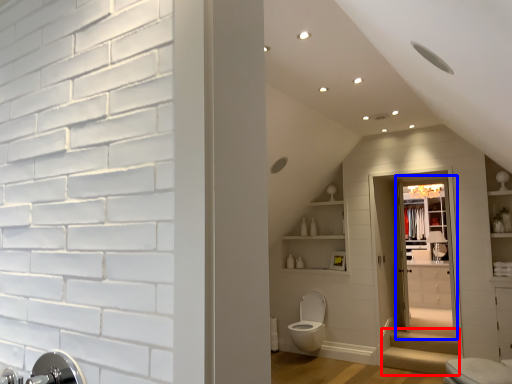
Question: Which of the following is the farthest to the observer, stairwell (highlighted by a red box) or glass door (highlighted by a blue box)?

Choices:
 (A) stairwell
 (B) glass door

Answer: (B)